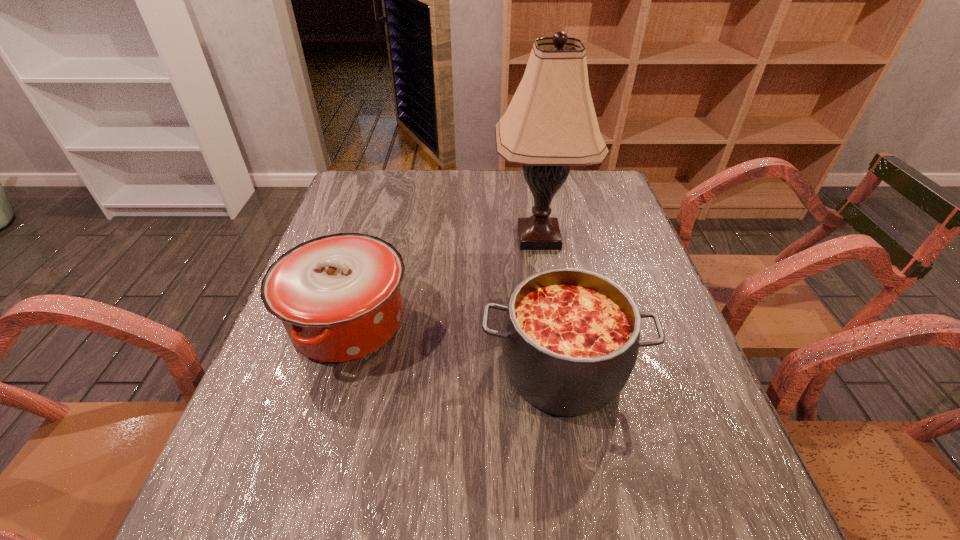
You are a GUI agent. You are given a task and a screenshot of the screen. Output one action in this format:
    pyautogui.click(x=<x>, y=<y>)
    Task: Click on the free location at the far edge of the desktop
    The image size is (960, 540).
    Given the screenshot: What is the action you would take?
    pyautogui.click(x=503, y=185)

At what (x,y) coordinates should I click in order to perform the action: click on vacant area at the near edge. Please return your answer as a coordinate pair (x, y). This screenshot has height=540, width=960. Looking at the image, I should click on (461, 532).

You are a GUI agent. You are given a task and a screenshot of the screen. Output one action in this format:
    pyautogui.click(x=<x>, y=<y>)
    Task: Click on the free space at the right edge
    Image resolution: width=960 pixels, height=540 pixels.
    Given the screenshot: What is the action you would take?
    pyautogui.click(x=661, y=362)

The image size is (960, 540). I want to click on free region at the far left corner, so click(x=347, y=204).

This screenshot has height=540, width=960. I want to click on vacant area at the near left corner of the desktop, so click(263, 510).

Find the location of a particular element. The width and height of the screenshot is (960, 540). free location at the far right corner of the desktop is located at coordinates (580, 191).

This screenshot has width=960, height=540. I want to click on free spot between the leftmost object and the right casserole, so click(455, 345).

The image size is (960, 540). I want to click on free space between the leftmost object and the farthest object, so [444, 280].

The image size is (960, 540). Find the location of `unoccupied position between the right casserole and the leftmost object`. unoccupied position between the right casserole and the leftmost object is located at coordinates (455, 345).

I want to click on free area in between the leftmost object and the lamp, so click(444, 280).